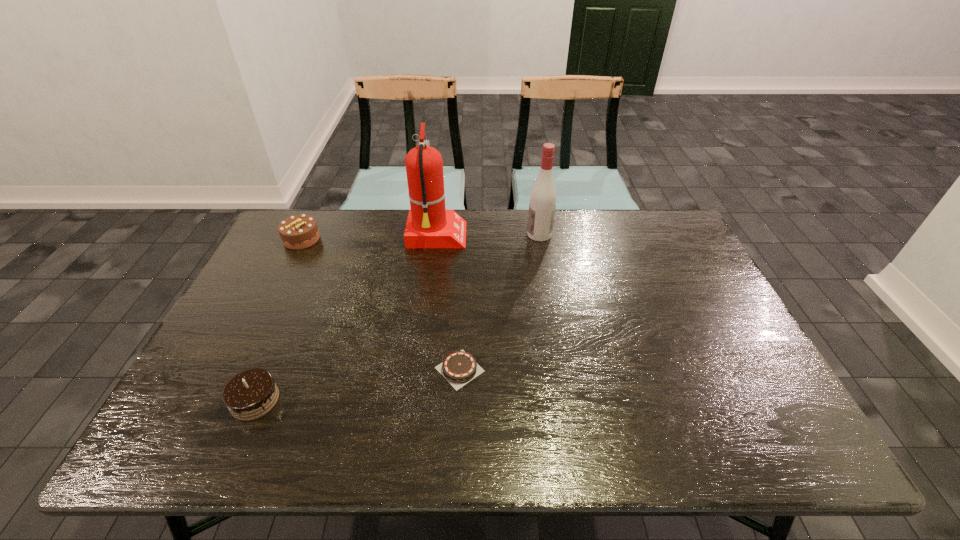
What are the coordinates of `vacant space situated 0.340m on the back of the shortest object` in the screenshot? It's located at (464, 263).

Identify the location of fire extinguisher at the far edge. The image size is (960, 540). pos(429,225).

Where is `alcohol located in the far edge section of the desktop`? This screenshot has width=960, height=540. alcohol located in the far edge section of the desktop is located at coordinates (543, 196).

This screenshot has height=540, width=960. In order to click on chocolate cake that is at the far edge in this screenshot , I will do `click(297, 232)`.

The image size is (960, 540). Find the location of `object that is at the near edge`. object that is at the near edge is located at coordinates (250, 394).

You are a GUI agent. You are given a task and a screenshot of the screen. Output one action in this format:
    pyautogui.click(x=<x>, y=<y>)
    Task: Click on the object that is at the far left corner
    Image resolution: width=960 pixels, height=540 pixels.
    Given the screenshot: What is the action you would take?
    pyautogui.click(x=297, y=232)

Where is `object that is at the near left corner`? object that is at the near left corner is located at coordinates (250, 394).

In the image, there is a desktop. At what (x,y) coordinates should I click in order to perform the action: click on vacant region at the far edge. Please return your answer as a coordinate pair (x, y). The width and height of the screenshot is (960, 540). Looking at the image, I should click on (503, 232).

The width and height of the screenshot is (960, 540). Identify the location of vacant region at the near edge of the desktop. (500, 427).

In the image, there is a desktop. Where is `vacant space at the left edge`? This screenshot has height=540, width=960. vacant space at the left edge is located at coordinates (223, 387).